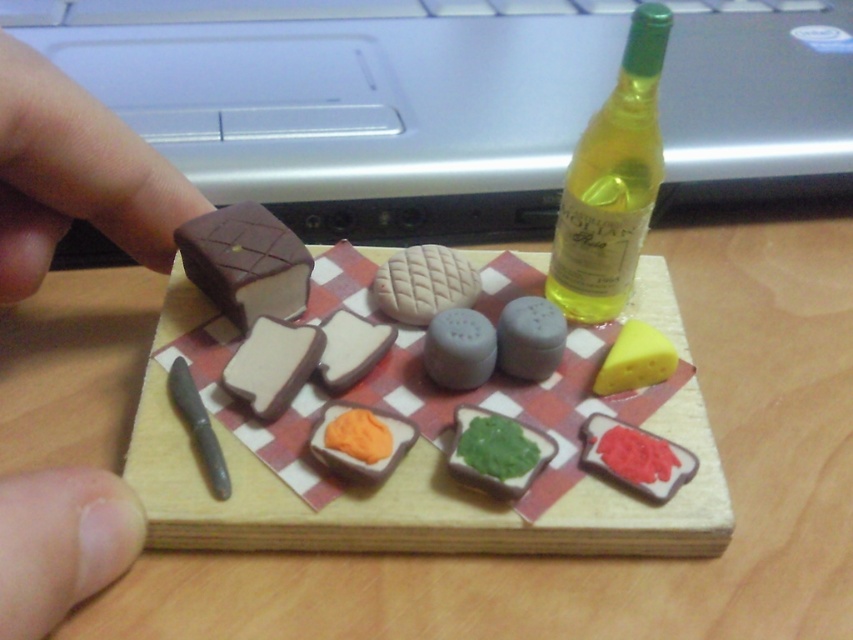
Question: Which of the following is the farthest from the observer?

Choices:
 (A) yellow rubbery cheese at center right
 (B) wooden cutting board at center

Answer: (A)

Question: Which object appears closest to the camera in this image?

Choices:
 (A) green matte spread at center
 (B) flesh-toned skin at lower left
 (C) green glass bottle at upper right
 (D) gray rubber salt and pepper shakers at center

Answer: (B)

Question: Does green matte spread at center appear on the left side of white matte cheese at center?

Choices:
 (A) no
 (B) yes

Answer: (A)

Question: Where is brown matte chocolate at upper left located in relation to white matte cheese at center in the image?

Choices:
 (A) right
 (B) left

Answer: (B)

Question: Which point appears farthest from the camera in this image?

Choices:
 (A) (99, 147)
 (B) (257, 291)
 (C) (432, 355)
 (D) (67, 508)

Answer: (B)

Question: Is white matte cheese at center smaller than yellow rubbery cheese at center right?

Choices:
 (A) no
 (B) yes

Answer: (B)